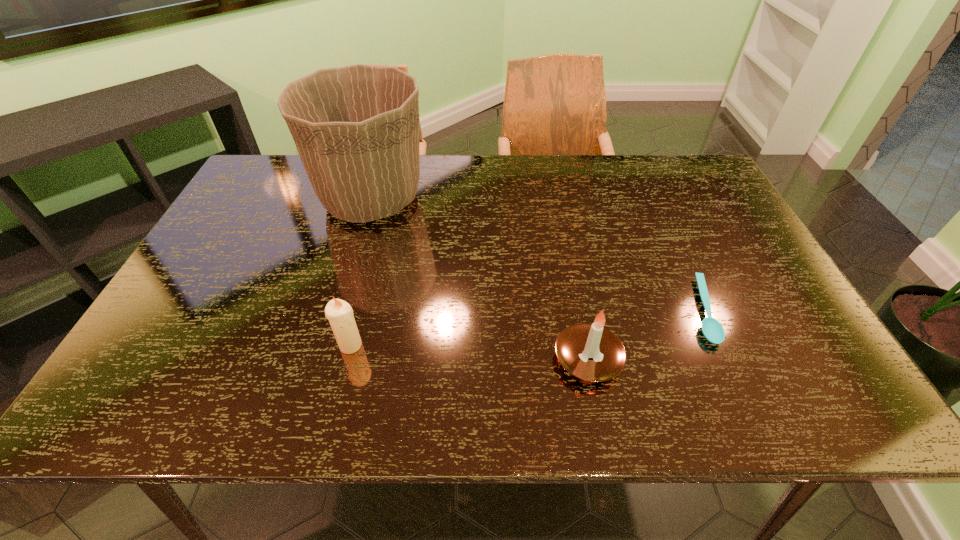
At what (x,y) coordinates should I click in order to perform the action: click on the farthest object. Please return your answer as a coordinate pair (x, y). This screenshot has width=960, height=540. Looking at the image, I should click on (357, 129).

What are the coordinates of `the tallest object` in the screenshot? It's located at (357, 129).

This screenshot has width=960, height=540. I want to click on the right candle, so click(x=591, y=352).

You are a GUI agent. You are given a task and a screenshot of the screen. Output one action in this format:
    pyautogui.click(x=<x>, y=<y>)
    Task: Click on the left candle
    
    Given the screenshot: What is the action you would take?
    pyautogui.click(x=339, y=313)

The height and width of the screenshot is (540, 960). In order to click on the shortest object in this screenshot , I will do `click(712, 330)`.

Where is `the rightmost object`? the rightmost object is located at coordinates (712, 330).

You are a GUI agent. You are given a task and a screenshot of the screen. Output one action in this format:
    pyautogui.click(x=<x>, y=<y>)
    Task: Click on the vacant space located on the right of the farthest object
    This screenshot has width=960, height=540.
    Given the screenshot: What is the action you would take?
    pyautogui.click(x=495, y=199)

At what (x,y) coordinates should I click in order to perform the action: click on free space located on the front of the right candle. Please return your answer as a coordinate pair (x, y). The height and width of the screenshot is (540, 960). Looking at the image, I should click on (600, 417).

Locate an element on the screen. The height and width of the screenshot is (540, 960). blank space located on the left of the left candle is located at coordinates (224, 345).

At what (x,y) coordinates should I click in order to perform the action: click on free space located 0.180m on the back of the shortest object. Please return your answer as a coordinate pair (x, y). The width and height of the screenshot is (960, 540). Looking at the image, I should click on (666, 231).